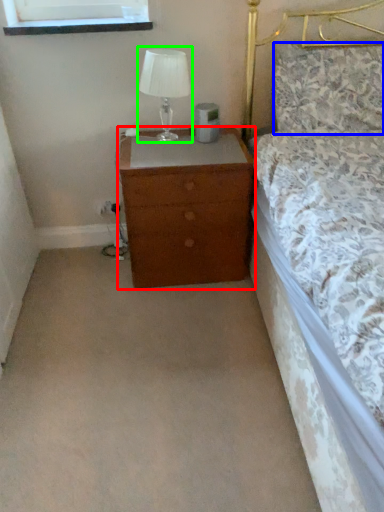
Question: Which is nearer to the chest of drawers (highlighted by a red box)? pillow (highlighted by a blue box) or table lamp (highlighted by a green box).

Choices:
 (A) pillow
 (B) table lamp

Answer: (B)